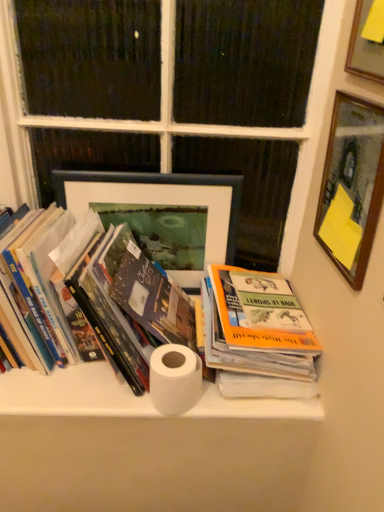
Image resolution: width=384 pixels, height=512 pixels. Find the location of `free space above orange matte book at center, which ranks as the second book in left-to-right order (from a real-world perspective)`. free space above orange matte book at center, which ranks as the second book in left-to-right order (from a real-world perspective) is located at coordinates (237, 288).